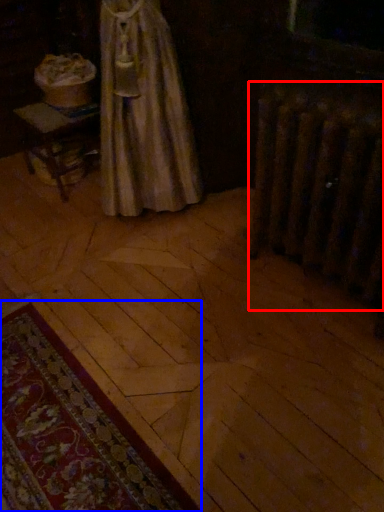
Question: Which object appears farthest to the camera in this image, radiator (highlighted by a red box) or mat (highlighted by a blue box)?

Choices:
 (A) radiator
 (B) mat

Answer: (A)